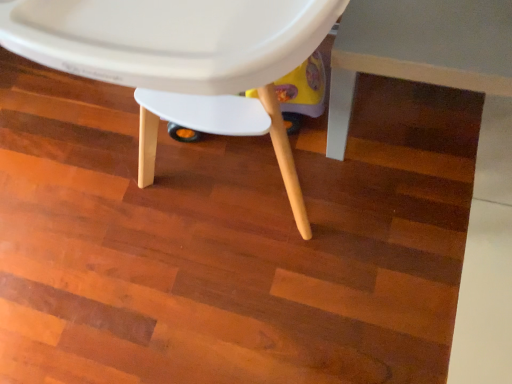
Locate an element on the screen. vacant space that's between white matte plastic chair at center and white matte table at lower right is located at coordinates (384, 213).